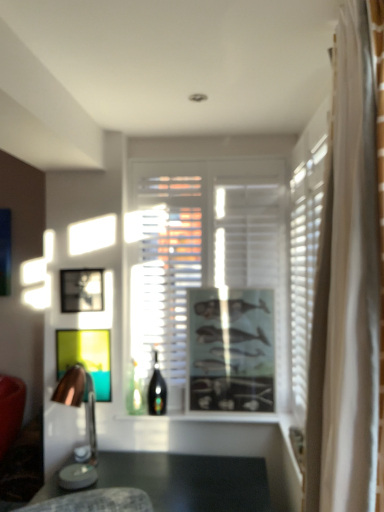
Question: Does wooden lampshade at left have a lesser height compared to metallic silver picture frame at center, the first picture frame positioned from the left?

Choices:
 (A) no
 (B) yes

Answer: (A)

Question: From a real-world perspective, is wooden lampshade at left on metallic silver picture frame at center, marked as the third picture frame in a right-to-left arrangement?

Choices:
 (A) no
 (B) yes

Answer: (A)

Question: From a real-world perspective, does wooden lampshade at left sit lower than metallic silver picture frame at center, the first picture frame positioned from the left?

Choices:
 (A) yes
 (B) no

Answer: (A)

Question: Could you tell me if wooden lampshade at left is turned towards metallic silver picture frame at center, marked as the third picture frame in a right-to-left arrangement?

Choices:
 (A) no
 (B) yes

Answer: (A)

Question: Considering the relative positions of wooden lampshade at left and metallic silver picture frame at center, the first picture frame positioned from the left, in the image provided, is wooden lampshade at left behind metallic silver picture frame at center, the first picture frame positioned from the left,?

Choices:
 (A) yes
 (B) no

Answer: (B)

Question: Does point (183, 167) appear closer or farther from the camera than point (162, 393)?

Choices:
 (A) closer
 (B) farther

Answer: (B)

Question: From the image's perspective, is transparent glass window at center positioned above or below shiny glass bottle at center?

Choices:
 (A) above
 (B) below

Answer: (A)

Question: Would you say transparent glass window at center is inside or outside shiny glass bottle at center?

Choices:
 (A) outside
 (B) inside

Answer: (A)

Question: Is transparent glass window at center in front of or behind shiny glass bottle at center in the image?

Choices:
 (A) front
 (B) behind

Answer: (B)

Question: From a real-world perspective, is wooden lampshade at left physically located above or below matte black picture frame at center, acting as the 1th picture frame starting from the right?

Choices:
 (A) below
 (B) above

Answer: (A)

Question: From the image's perspective, is wooden lampshade at left positioned above or below matte black picture frame at center, the 3th picture frame when ordered from left to right?

Choices:
 (A) below
 (B) above

Answer: (A)

Question: Visually, is wooden lampshade at left positioned to the left or to the right of matte black picture frame at center, the 3th picture frame when ordered from left to right?

Choices:
 (A) left
 (B) right

Answer: (A)

Question: In terms of height, does wooden lampshade at left look taller or shorter compared to matte black picture frame at center, acting as the 1th picture frame starting from the right?

Choices:
 (A) short
 (B) tall

Answer: (A)

Question: Is transparent glass window at center inside or outside of metallic silver picture frame at center, the first picture frame positioned from the left?

Choices:
 (A) inside
 (B) outside

Answer: (B)

Question: From the image's perspective, relative to metallic silver picture frame at center, the first picture frame positioned from the left, is transparent glass window at center above or below?

Choices:
 (A) above
 (B) below

Answer: (A)